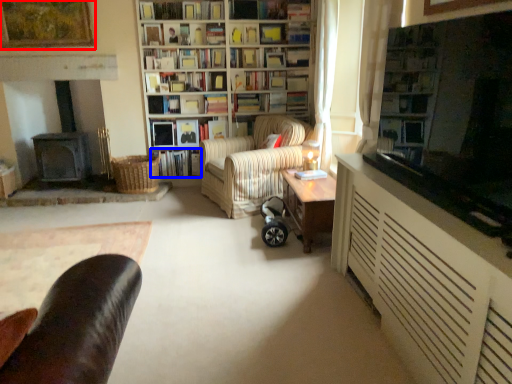
Question: Which of the following is the closest to the observer, picture frame (highlighted by a red box) or book (highlighted by a blue box)?

Choices:
 (A) picture frame
 (B) book

Answer: (A)